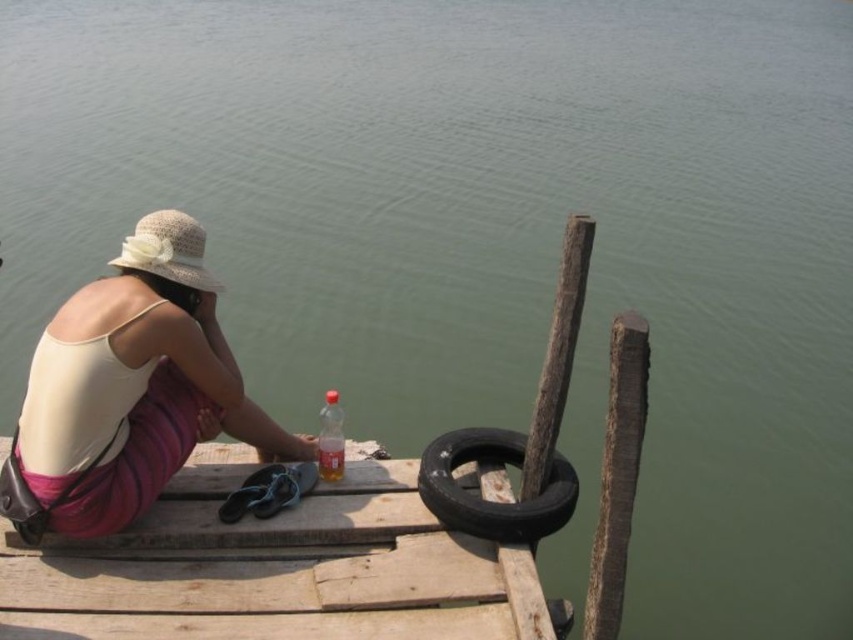
You are standing on the wooden dock at center and want to place a small potted plant on the white woven hat at upper left. Is the hat accessible from your current position?

The wooden dock at center is in front of the white woven hat at upper left, meaning the hat is behind the dock from your perspective. Since the dock blocks the path, you cannot directly access or place the potted plant on the white woven hat at upper left while standing on the wooden dock at center.

You are standing on the dock and want to place a small potted plant between the white woven hat at upper left and the black rubber tire at lower center. Based on their positions, where should you place it?

The white woven hat at upper left is positioned over the black rubber tire at lower center, so placing the potted plant between them would require placing it below the white woven hat at upper left and above the black rubber tire at lower center.